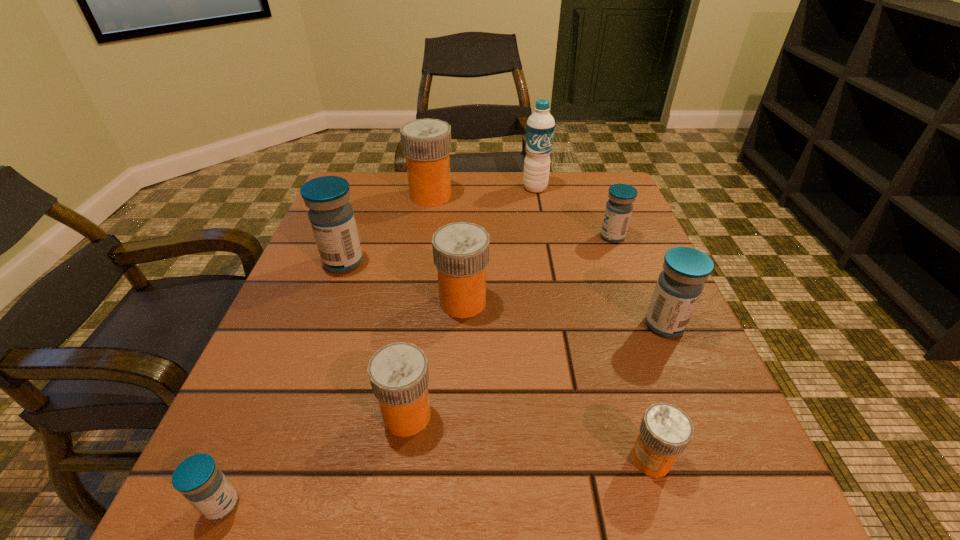
Find the location of a particular element. The height and width of the screenshot is (540, 960). the tallest object is located at coordinates (540, 126).

Locate an element on the screen. The height and width of the screenshot is (540, 960). water bottle is located at coordinates (x=540, y=126).

Where is `the farthest orange medicine`? The width and height of the screenshot is (960, 540). the farthest orange medicine is located at coordinates (426, 143).

Find the location of a particular element. This screenshot has width=960, height=540. the farthest medicine is located at coordinates (426, 143).

Find the location of `the fourth farthest object`. the fourth farthest object is located at coordinates (332, 219).

Locate an element on the screen. the biggest blue medicine is located at coordinates (332, 219).

Image resolution: width=960 pixels, height=540 pixels. In order to click on the second biggest orange medicine in this screenshot , I will do `click(460, 250)`.

This screenshot has width=960, height=540. I want to click on the third farthest blue medicine, so click(681, 282).

Where is `the second smallest orange medicine`? The width and height of the screenshot is (960, 540). the second smallest orange medicine is located at coordinates point(399,375).

The width and height of the screenshot is (960, 540). Identify the location of the third farthest object. (619, 207).